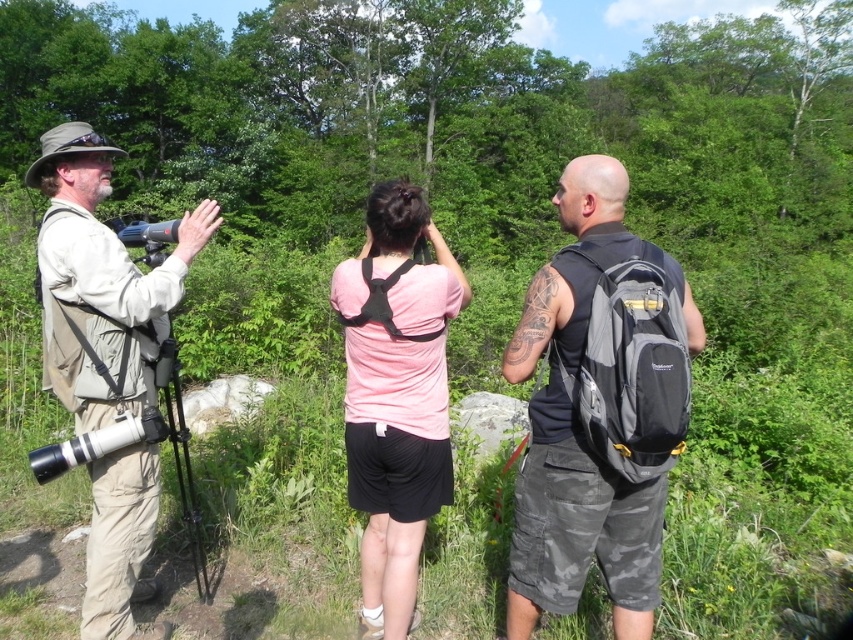
Is pink fabric shirt at center bigger than black fabric backpack at center?

Yes, pink fabric shirt at center is bigger than black fabric backpack at center.

Does pink fabric shirt at center have a greater width compared to black fabric backpack at center?

Correct, the width of pink fabric shirt at center exceeds that of black fabric backpack at center.

Where is `pink fabric shirt at center`? pink fabric shirt at center is located at coordinates (396, 394).

Identify the location of pink fabric shirt at center. (396, 394).

Which is behind, point (48, 374) or point (572, 220)?

The point (48, 374) is behind.

Does point (93, 284) come farther from viewer compared to point (564, 314)?

Yes, point (93, 284) is farther from viewer.

At what (x,y) coordinates should I click in order to perform the action: click on khaki fabric shirt at left. Please return your answer as a coordinate pair (x, y). The width and height of the screenshot is (853, 640). Looking at the image, I should click on (102, 284).

The height and width of the screenshot is (640, 853). Describe the element at coordinates (590, 193) in the screenshot. I see `black fabric backpack at center` at that location.

Does point (552, 314) come closer to viewer compared to point (187, 461)?

That is True.

What do you see at coordinates (590, 193) in the screenshot? The image size is (853, 640). I see `black fabric backpack at center` at bounding box center [590, 193].

Locate an element on the screen. black fabric backpack at center is located at coordinates (590, 193).